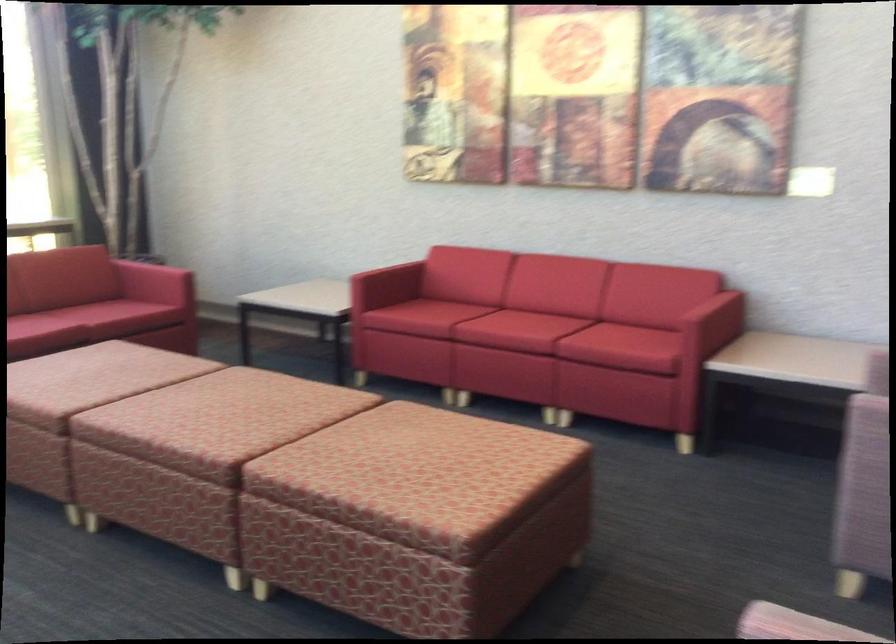
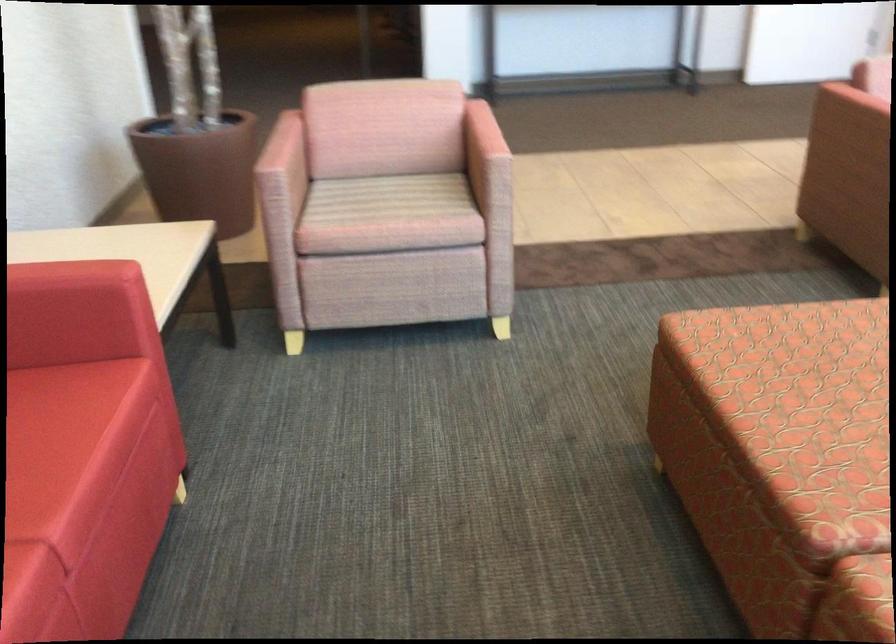
In the second image, find the point that corresponds to point 645,334 in the first image.

(38, 408)